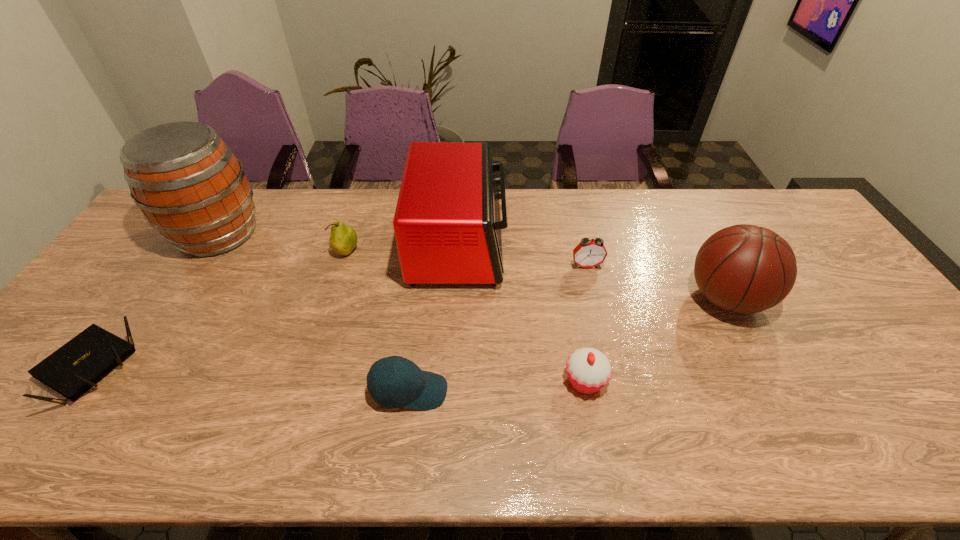
In the image, there is a desktop. Find the location of `vacant area at the left edge`. vacant area at the left edge is located at coordinates tap(32, 418).

The image size is (960, 540). I want to click on empty location between the pear and the baseball cap, so click(x=378, y=321).

Identify the location of blank region between the cupcake and the tallest object. The image size is (960, 540). (401, 307).

Find the location of a particular element. free space between the toaster oven and the alarm clock is located at coordinates (522, 255).

Find the location of a particular element. Image resolution: width=960 pixels, height=540 pixels. free space between the cider and the baseball cap is located at coordinates [314, 312].

Locate an element on the screen. Image resolution: width=960 pixels, height=540 pixels. vacant region between the alarm clock and the toaster oven is located at coordinates (522, 255).

Locate an element on the screen. free space between the baseball cap and the cupcake is located at coordinates [497, 386].

The image size is (960, 540). Identify the location of vacant point located between the baseball cap and the toaster oven. (434, 318).

This screenshot has height=540, width=960. Find the location of `free area in between the baseball cap and the rightmost object`. free area in between the baseball cap and the rightmost object is located at coordinates (567, 345).

At what (x,y) coordinates should I click in order to perform the action: click on object that is the closest to the alarm clock. Please return your answer as a coordinate pair (x, y). Looking at the image, I should click on (447, 223).